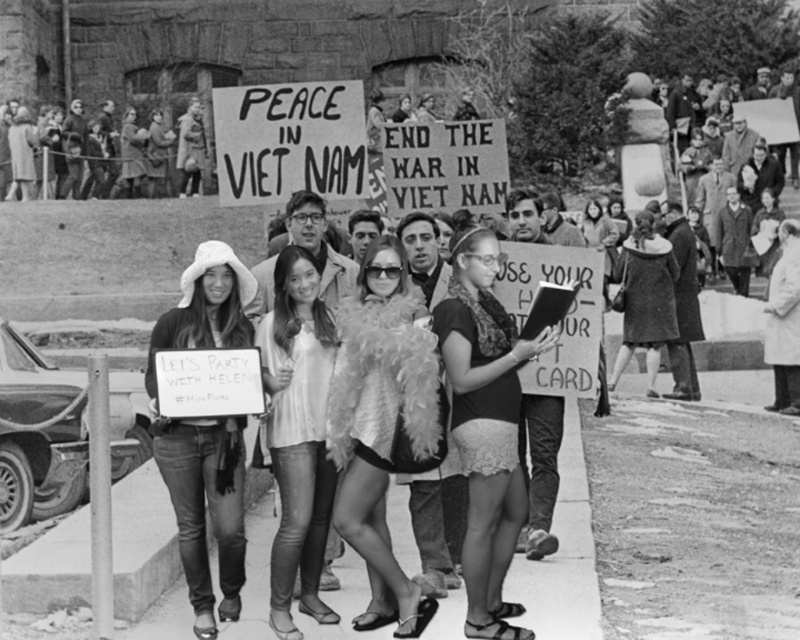
You are a photographer who wants to capture a closeup of the black lace shorts at center. Based on their position at point 0.664, 0.608, would you need to adjust your camera focus to ensure clarity?

The black lace shorts at center are positioned at point [486,424], so the photographer should adjust the camera focus to that coordinate to ensure clarity.